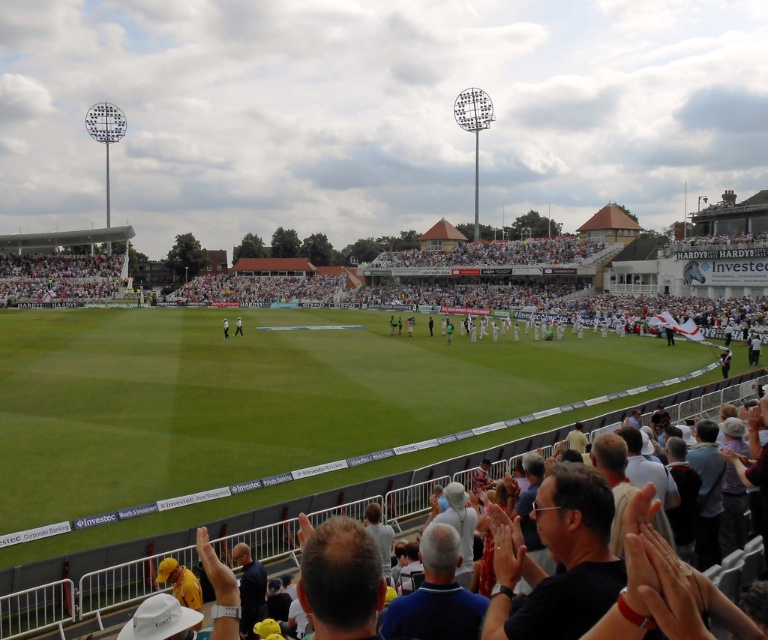
Who is lower down, white fabric crowd at upper left or light brown leather jacket at center?

light brown leather jacket at center is lower down.

This screenshot has height=640, width=768. In order to click on white fabric crowd at upper left in this screenshot , I will do `click(58, 276)`.

The width and height of the screenshot is (768, 640). I want to click on white fabric crowd at upper left, so (x=58, y=276).

Which is below, white fabric crowd at upper left or white fabric person at center?

white fabric person at center

Is white fabric crowd at upper left closer to the viewer compared to white fabric person at center?

No, white fabric crowd at upper left is behind white fabric person at center.

Does point (25, 266) come in front of point (224, 323)?

No, (25, 266) is further to viewer.

At what (x,y) coordinates should I click in order to perform the action: click on white fabric crowd at upper left. Please return your answer as a coordinate pair (x, y). Looking at the image, I should click on (58, 276).

Which of these two, light brown leather jacket at center or white fabric person at center, stands taller?

With more height is light brown leather jacket at center.

Does light brown leather jacket at center appear under white fabric person at center?

No, light brown leather jacket at center is not below white fabric person at center.

Does point (240, 336) come in front of point (224, 332)?

No, (240, 336) is further to viewer.

You are a GUI agent. You are given a task and a screenshot of the screen. Output one action in this format:
    pyautogui.click(x=<x>, y=<y>)
    Task: Click on the light brown leather jacket at center
    
    Given the screenshot: What is the action you would take?
    pyautogui.click(x=237, y=326)